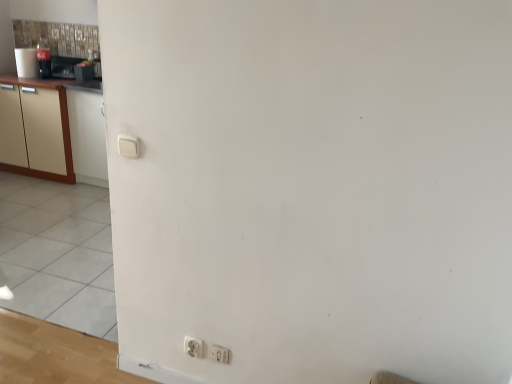
Describe the element at coordinates (193, 347) in the screenshot. I see `white plastic electric outlet at lower center, which appears as the first electric outlet when viewed from the left` at that location.

I want to click on white plastic electric outlet at lower center, which appears as the first electric outlet when viewed from the left, so click(193, 347).

The width and height of the screenshot is (512, 384). Identify the location of metallic silver toaster at upper left. (83, 72).

This screenshot has width=512, height=384. Find the location of `white plastic electric outlet at lower center, the second electric outlet when ordered from left to right`. white plastic electric outlet at lower center, the second electric outlet when ordered from left to right is located at coordinates (219, 354).

Describe the element at coordinates (53, 130) in the screenshot. I see `beige wood cabinetry at left` at that location.

I want to click on white plastic electric outlet at lower center, which appears as the first electric outlet when viewed from the left, so click(193, 347).

From the image's perspective, is metallic silver toaster at upper left on white plastic electric outlet at lower center, which is counted as the second electric outlet, starting from the right?

Indeed, from the image's perspective, metallic silver toaster at upper left is shown above white plastic electric outlet at lower center, which is counted as the second electric outlet, starting from the right.

From a real-world perspective, which is physically below, metallic silver toaster at upper left or white plastic electric outlet at lower center, which appears as the first electric outlet when viewed from the left?

white plastic electric outlet at lower center, which appears as the first electric outlet when viewed from the left, from a real-world perspective.

Is metallic silver toaster at upper left outside of white plastic electric outlet at lower center, which appears as the first electric outlet when viewed from the left?

Yes, metallic silver toaster at upper left is outside of white plastic electric outlet at lower center, which appears as the first electric outlet when viewed from the left.

Considering the sizes of objects white plastic electric outlet at lower center, the second electric outlet when ordered from left to right, and beige wood cabinetry at left in the image provided, who is shorter, white plastic electric outlet at lower center, the second electric outlet when ordered from left to right, or beige wood cabinetry at left?

white plastic electric outlet at lower center, the second electric outlet when ordered from left to right.

Is white plastic electric outlet at lower center, which is the 1th electric outlet in right-to-left order, positioned with its back to beige wood cabinetry at left?

That's not correct — white plastic electric outlet at lower center, which is the 1th electric outlet in right-to-left order, is not looking away from beige wood cabinetry at left.

Locate an element on the screen. cabinetry that appears on the left of white plastic electric outlet at lower center, the second electric outlet when ordered from left to right is located at coordinates (53, 130).

Can you confirm if metallic silver toaster at upper left is thinner than white plastic electric outlet at lower center, the second electric outlet when ordered from left to right?

Incorrect, the width of metallic silver toaster at upper left is not less than that of white plastic electric outlet at lower center, the second electric outlet when ordered from left to right.

Which is behind, metallic silver toaster at upper left or white plastic electric outlet at lower center, the second electric outlet when ordered from left to right?

metallic silver toaster at upper left is further away from the camera.

From the image's perspective, between metallic silver toaster at upper left and white plastic electric outlet at lower center, which is the 1th electric outlet in right-to-left order, who is located below?

white plastic electric outlet at lower center, which is the 1th electric outlet in right-to-left order, is shown below in the image.

How many degrees apart are the facing directions of white plastic electric outlet at lower center, which appears as the first electric outlet when viewed from the left, and beige wood cabinetry at left?

The facing directions of white plastic electric outlet at lower center, which appears as the first electric outlet when viewed from the left, and beige wood cabinetry at left are 0.00045 degrees apart.

Can you confirm if white plastic electric outlet at lower center, which appears as the first electric outlet when viewed from the left, is bigger than beige wood cabinetry at left?

No, white plastic electric outlet at lower center, which appears as the first electric outlet when viewed from the left, is not bigger than beige wood cabinetry at left.

Is there a large distance between white plastic electric outlet at lower center, which is counted as the second electric outlet, starting from the right, and beige wood cabinetry at left?

Yes, white plastic electric outlet at lower center, which is counted as the second electric outlet, starting from the right, and beige wood cabinetry at left are quite far apart.

Which object is thinner, white plastic electric outlet at lower center, which appears as the first electric outlet when viewed from the left, or beige wood cabinetry at left?

white plastic electric outlet at lower center, which appears as the first electric outlet when viewed from the left.

Are beige wood cabinetry at left and metallic silver toaster at upper left making contact?

No, beige wood cabinetry at left is not touching metallic silver toaster at upper left.

Is beige wood cabinetry at left oriented towards metallic silver toaster at upper left?

No.

Identify the location of appliance on the right of beige wood cabinetry at left. The height and width of the screenshot is (384, 512). (83, 72).

Considering the relative sizes of metallic silver toaster at upper left and beige wood cabinetry at left in the image provided, is metallic silver toaster at upper left taller than beige wood cabinetry at left?

No, metallic silver toaster at upper left is not taller than beige wood cabinetry at left.

Consider the image. Looking at their sizes, would you say metallic silver toaster at upper left is wider or thinner than beige wood cabinetry at left?

metallic silver toaster at upper left is thinner than beige wood cabinetry at left.

The width and height of the screenshot is (512, 384). I want to click on cabinetry that appears in front of the metallic silver toaster at upper left, so click(53, 130).

Where is `cabinetry above the white plastic electric outlet at lower center, which appears as the first electric outlet when viewed from the left (from a real-world perspective)`? cabinetry above the white plastic electric outlet at lower center, which appears as the first electric outlet when viewed from the left (from a real-world perspective) is located at coordinates (53, 130).

From the picture: Can you confirm if beige wood cabinetry at left is taller than white plastic electric outlet at lower center, which appears as the first electric outlet when viewed from the left?

Yes.

In the image, is beige wood cabinetry at left positioned in front of or behind white plastic electric outlet at lower center, which appears as the first electric outlet when viewed from the left?

Clearly, beige wood cabinetry at left is behind white plastic electric outlet at lower center, which appears as the first electric outlet when viewed from the left.

Considering the relative positions of beige wood cabinetry at left and white plastic electric outlet at lower center, which appears as the first electric outlet when viewed from the left, in the image provided, is beige wood cabinetry at left to the left of white plastic electric outlet at lower center, which appears as the first electric outlet when viewed from the left, from the viewer's perspective?

Indeed, beige wood cabinetry at left is positioned on the left side of white plastic electric outlet at lower center, which appears as the first electric outlet when viewed from the left.

Find the location of a particular element. Image resolution: width=512 pixels, height=384 pixels. appliance above the white plastic electric outlet at lower center, which appears as the first electric outlet when viewed from the left (from the image's perspective) is located at coordinates (83, 72).

At what (x,y) coordinates should I click in order to perform the action: click on cabinetry located above the white plastic electric outlet at lower center, the second electric outlet when ordered from left to right (from a real-world perspective). Please return your answer as a coordinate pair (x, y). The image size is (512, 384). Looking at the image, I should click on (53, 130).

Considering their positions, is beige wood cabinetry at left positioned closer to white plastic electric outlet at lower center, which is counted as the second electric outlet, starting from the right, than metallic silver toaster at upper left?

The object closer to white plastic electric outlet at lower center, which is counted as the second electric outlet, starting from the right, is beige wood cabinetry at left.

Looking at the image, which one is located closer to beige wood cabinetry at left, metallic silver toaster at upper left or white plastic electric outlet at lower center, which is the 1th electric outlet in right-to-left order?

metallic silver toaster at upper left is positioned closer to the anchor beige wood cabinetry at left.

Based on the photo, when comparing their distances from white plastic electric outlet at lower center, which is counted as the second electric outlet, starting from the right, does metallic silver toaster at upper left or beige wood cabinetry at left seem further?

Among the two, metallic silver toaster at upper left is located further to white plastic electric outlet at lower center, which is counted as the second electric outlet, starting from the right.

Which object lies further to the anchor point metallic silver toaster at upper left, white plastic electric outlet at lower center, which appears as the first electric outlet when viewed from the left, or beige wood cabinetry at left?

white plastic electric outlet at lower center, which appears as the first electric outlet when viewed from the left, lies further to metallic silver toaster at upper left than the other object.

When comparing their distances from white plastic electric outlet at lower center, which is the 1th electric outlet in right-to-left order, does metallic silver toaster at upper left or white plastic electric outlet at lower center, which appears as the first electric outlet when viewed from the left, seem further?

Based on the image, metallic silver toaster at upper left appears to be further to white plastic electric outlet at lower center, which is the 1th electric outlet in right-to-left order.

Which object lies nearer to the anchor point metallic silver toaster at upper left, beige wood cabinetry at left or white plastic electric outlet at lower center, the second electric outlet when ordered from left to right?

beige wood cabinetry at left.

Looking at the image, which one is located closer to beige wood cabinetry at left, white plastic electric outlet at lower center, which is the 1th electric outlet in right-to-left order, or metallic silver toaster at upper left?

metallic silver toaster at upper left is closer to beige wood cabinetry at left.

Looking at the image, which one is located further to white plastic electric outlet at lower center, which appears as the first electric outlet when viewed from the left, white plastic electric outlet at lower center, which is the 1th electric outlet in right-to-left order, or beige wood cabinetry at left?

beige wood cabinetry at left is further to white plastic electric outlet at lower center, which appears as the first electric outlet when viewed from the left.

At what (x,y) coordinates should I click in order to perform the action: click on electric outlet between white plastic electric outlet at lower center, which is the 1th electric outlet in right-to-left order, and metallic silver toaster at upper left, along the z-axis. Please return your answer as a coordinate pair (x, y). The height and width of the screenshot is (384, 512). Looking at the image, I should click on (193, 347).

The width and height of the screenshot is (512, 384). In order to click on cabinetry between white plastic electric outlet at lower center, which appears as the first electric outlet when viewed from the left, and metallic silver toaster at upper left from front to back in this screenshot , I will do `click(53, 130)`.

Where is `electric outlet between beige wood cabinetry at left and white plastic electric outlet at lower center, which is the 1th electric outlet in right-to-left order`? This screenshot has height=384, width=512. electric outlet between beige wood cabinetry at left and white plastic electric outlet at lower center, which is the 1th electric outlet in right-to-left order is located at coordinates (193, 347).

Where is `cabinetry positioned between white plastic electric outlet at lower center, the second electric outlet when ordered from left to right, and metallic silver toaster at upper left from near to far`? This screenshot has height=384, width=512. cabinetry positioned between white plastic electric outlet at lower center, the second electric outlet when ordered from left to right, and metallic silver toaster at upper left from near to far is located at coordinates (53, 130).